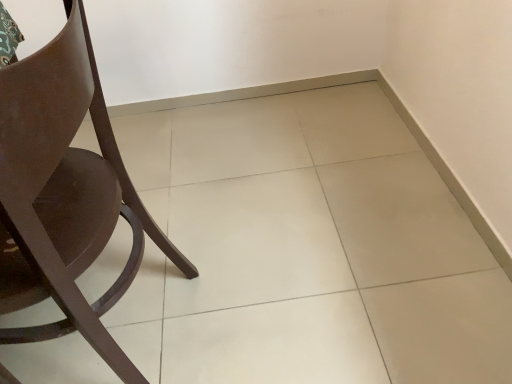
What are the coordinates of `matte brown chair at left` in the screenshot? It's located at (64, 194).

The width and height of the screenshot is (512, 384). What do you see at coordinates (64, 194) in the screenshot?
I see `matte brown chair at left` at bounding box center [64, 194].

You are a GUI agent. You are given a task and a screenshot of the screen. Output one action in this format:
    pyautogui.click(x=<x>, y=<y>)
    Task: Click on the matte brown chair at left
    
    Given the screenshot: What is the action you would take?
    pyautogui.click(x=64, y=194)